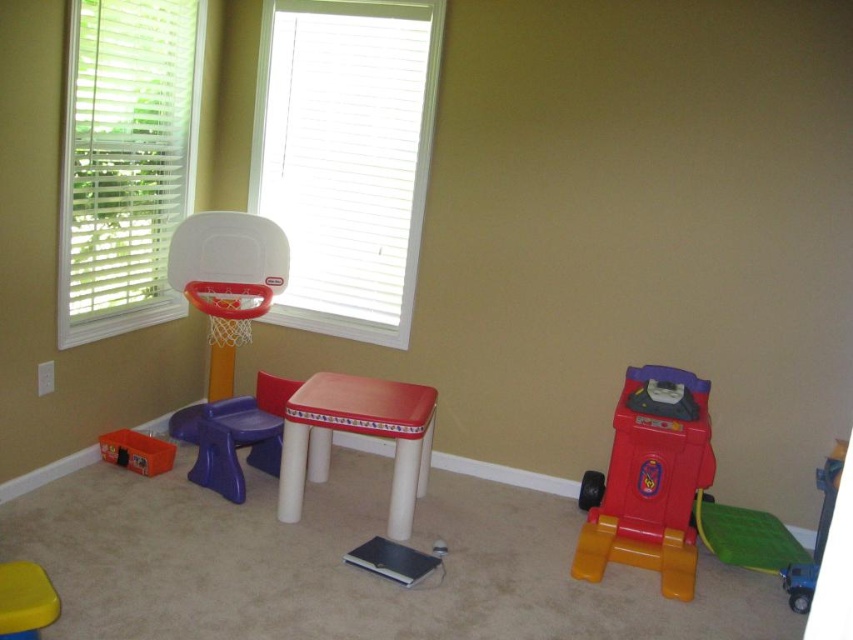
You are standing in the playroom and want to reach the point marked at coordinates (672, 454). If you can move forward 2 meters, will you be able to reach that point?

The distance between you and the point marked at coordinates (672, 454) is 2.76 meters. Since you can only move forward 2 meters, you will not be able to reach that point.

You are a parent trying to clean up the playroom. You see the rubberized plastic toy car at right and the yellow plastic stool at lower left. Which object is currently covering the other one?

The rubberized plastic toy car at right is positioned over the yellow plastic stool at lower left, so it is covering the stool.

You are a parent setting up a play area for your child. You have a purple plastic chair at center and a yellow plastic stool at lower left. Which one is positioned higher from the ground?

The purple plastic chair at center is located above the yellow plastic stool at lower left, so it is positioned higher from the ground.